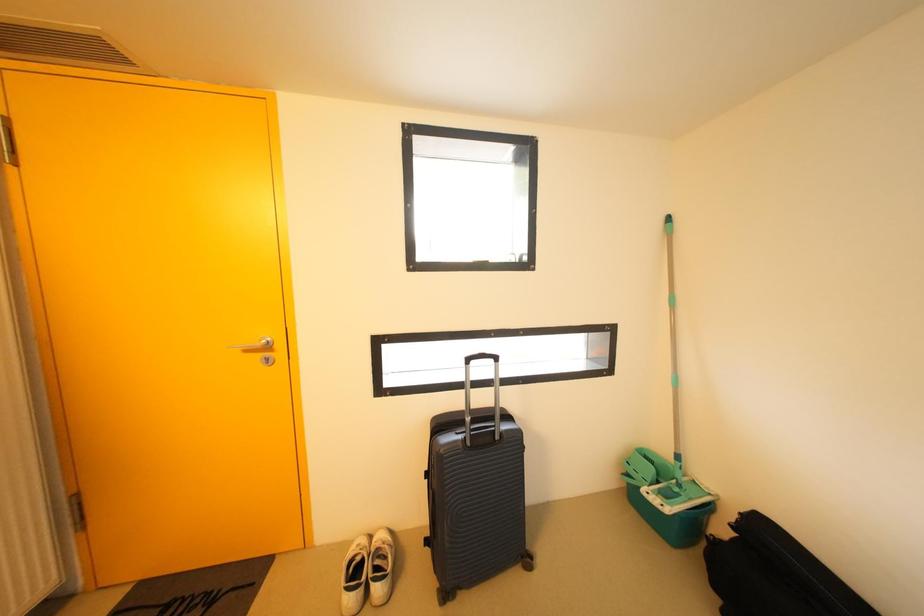
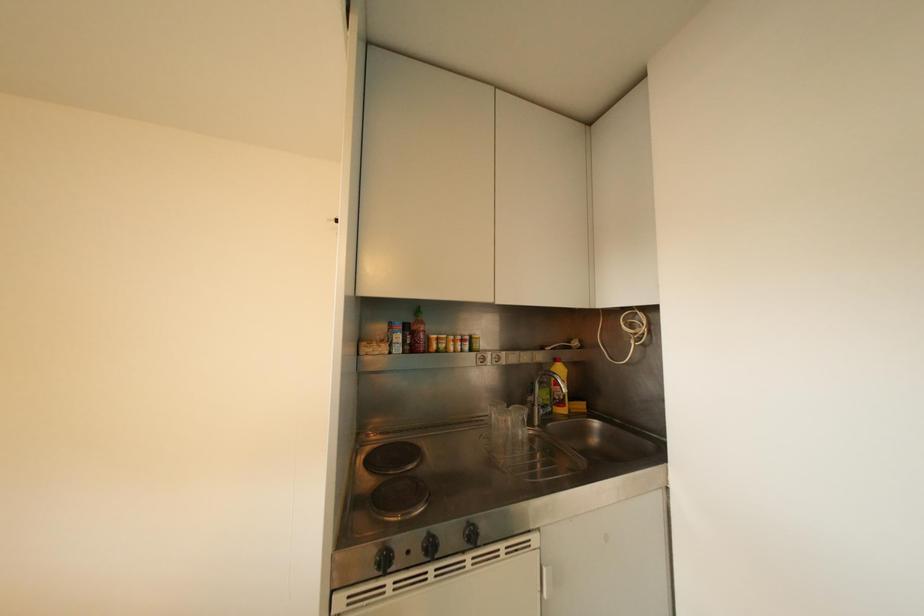
Question: The camera is either moving clockwise (left) or counter-clockwise (right) around the object. The first image is from the beginning of the video and the second image is from the end. Is the camera moving left or right when shooting the video?

Choices:
 (A) Left
 (B) Right

Answer: (A)